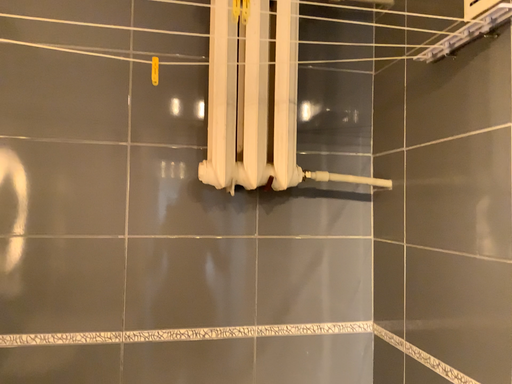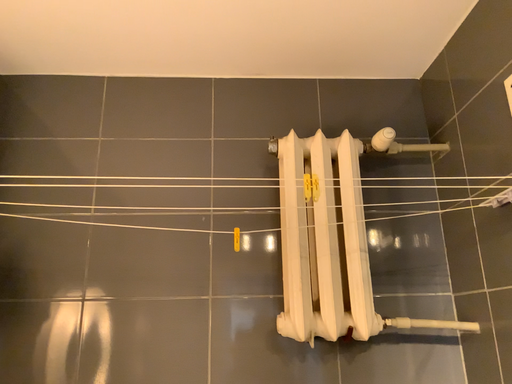
Question: Which way did the camera rotate in the video?

Choices:
 (A) rotated right
 (B) rotated left

Answer: (B)